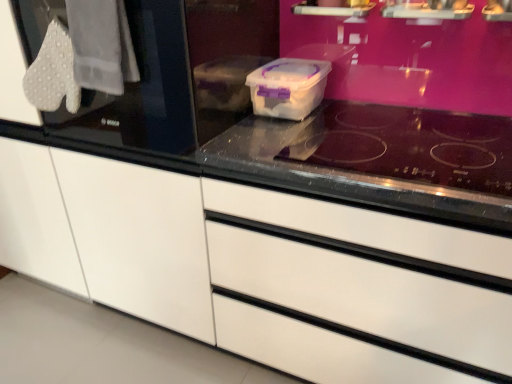
Question: Is white textured gloves at upper left located outside white glossy drawer at center?

Choices:
 (A) yes
 (B) no

Answer: (A)

Question: Are white textured gloves at upper left and white glossy drawer at center located far from each other?

Choices:
 (A) no
 (B) yes

Answer: (A)

Question: From a real-world perspective, is white textured gloves at upper left physically below white glossy drawer at center?

Choices:
 (A) no
 (B) yes

Answer: (A)

Question: Is white textured gloves at upper left positioned with its back to white glossy drawer at center?

Choices:
 (A) yes
 (B) no

Answer: (B)

Question: Is white textured gloves at upper left at the left side of white glossy drawer at center?

Choices:
 (A) yes
 (B) no

Answer: (A)

Question: In the image, is white glossy drawer at center positioned in front of or behind transparent glass door at left?

Choices:
 (A) front
 (B) behind

Answer: (A)

Question: Looking at their shapes, would you say white glossy drawer at center is wider or thinner than transparent glass door at left?

Choices:
 (A) thin
 (B) wide

Answer: (B)

Question: From the image's perspective, relative to transparent glass door at left, is white glossy drawer at center above or below?

Choices:
 (A) below
 (B) above

Answer: (A)

Question: Does point (312, 264) appear closer or farther from the camera than point (12, 1)?

Choices:
 (A) closer
 (B) farther

Answer: (A)

Question: Do you think white glossy drawer at center is within transparent glass at center, or outside of it?

Choices:
 (A) inside
 (B) outside

Answer: (B)

Question: Based on their positions, is white glossy drawer at center located to the left or right of transparent glass at center?

Choices:
 (A) right
 (B) left

Answer: (A)

Question: From a real-world perspective, relative to transparent glass at center, is white glossy drawer at center vertically above or below?

Choices:
 (A) below
 (B) above

Answer: (A)

Question: In terms of height, does white glossy drawer at center look taller or shorter compared to transparent glass at center?

Choices:
 (A) tall
 (B) short

Answer: (A)

Question: Looking at the image, does white textured gloves at upper left seem bigger or smaller compared to transparent glass door at left?

Choices:
 (A) small
 (B) big

Answer: (A)

Question: Is white textured gloves at upper left wider or thinner than transparent glass door at left?

Choices:
 (A) wide
 (B) thin

Answer: (B)